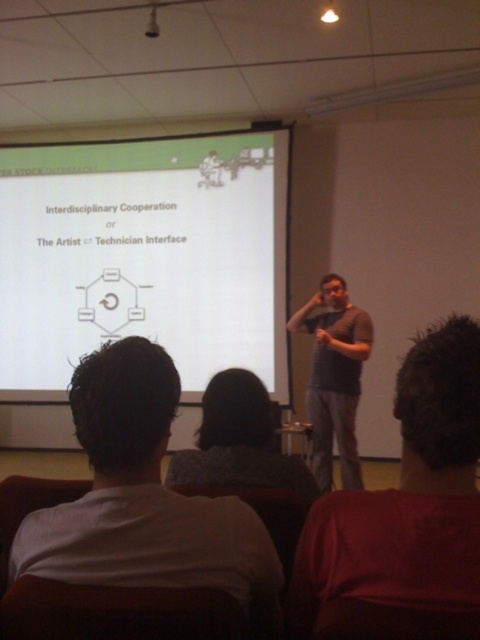
Question: Does dark brown hair at lower right have a smaller size compared to dark gray t-shirt at center?

Choices:
 (A) no
 (B) yes

Answer: (B)

Question: Can you confirm if white matte projection screen at upper center is positioned above gray knitted sweater at center?

Choices:
 (A) no
 (B) yes

Answer: (B)

Question: Can you confirm if dark brown hair at lower right is positioned above gray knitted sweater at center?

Choices:
 (A) yes
 (B) no

Answer: (A)

Question: Which point is closer to the camera taking this photo?

Choices:
 (A) (412, 483)
 (B) (124, 272)
 (C) (331, 458)

Answer: (A)

Question: Which point appears closest to the camera in this image?

Choices:
 (A) (117, 388)
 (B) (312, 413)

Answer: (A)

Question: Which point is farther to the camera?

Choices:
 (A) (158, 460)
 (B) (310, 320)
 (C) (446, 490)
 (D) (210, 456)

Answer: (B)